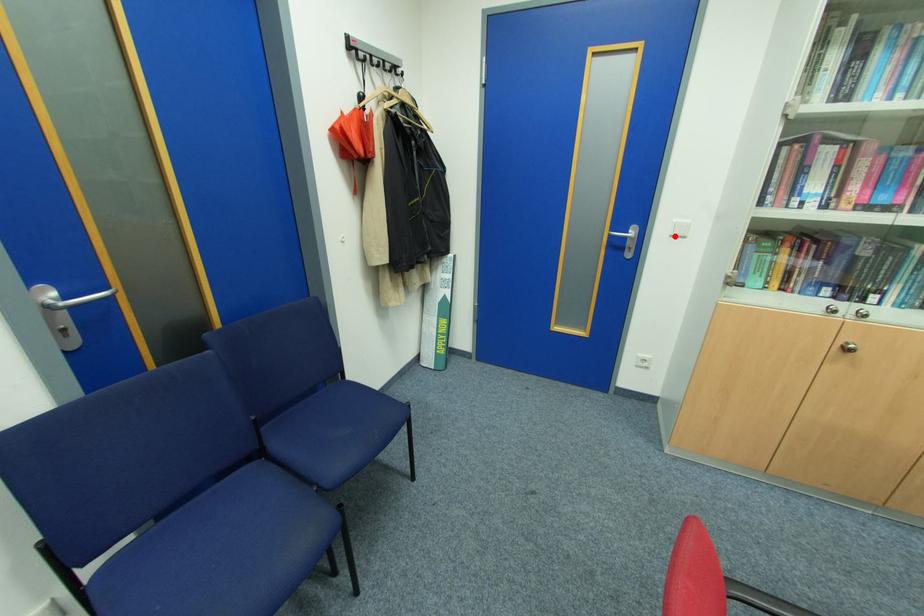
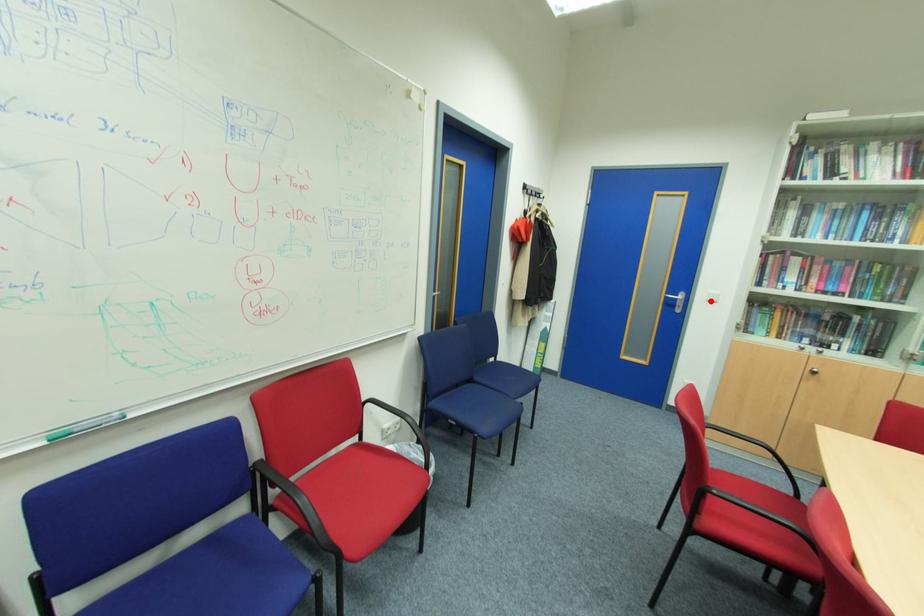
I am providing you with two images of the same scene from different viewpoints. A red point is marked on the first image and another point is marked on the second image. Do the highlighted points in image1 and image2 indicate the same real-world spot?

Yes